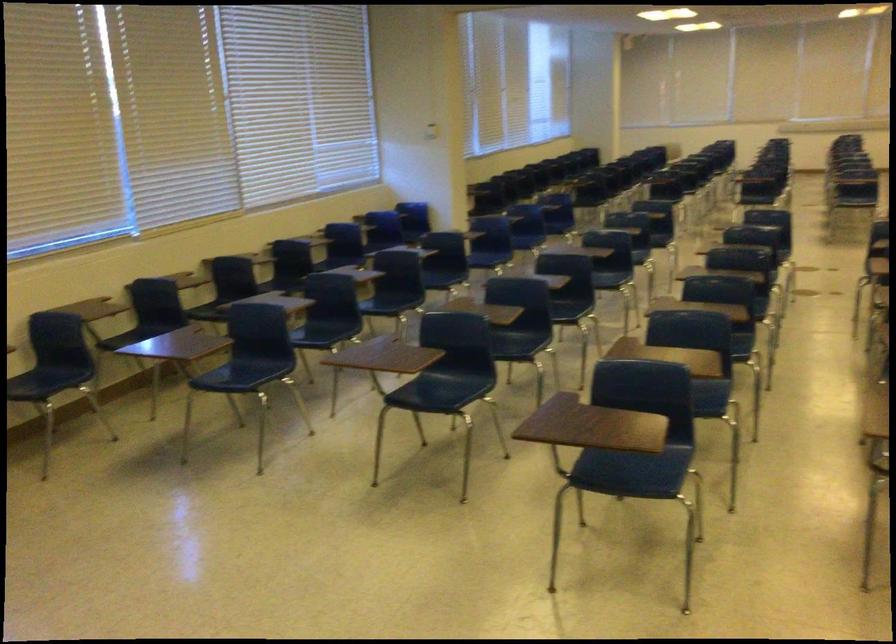
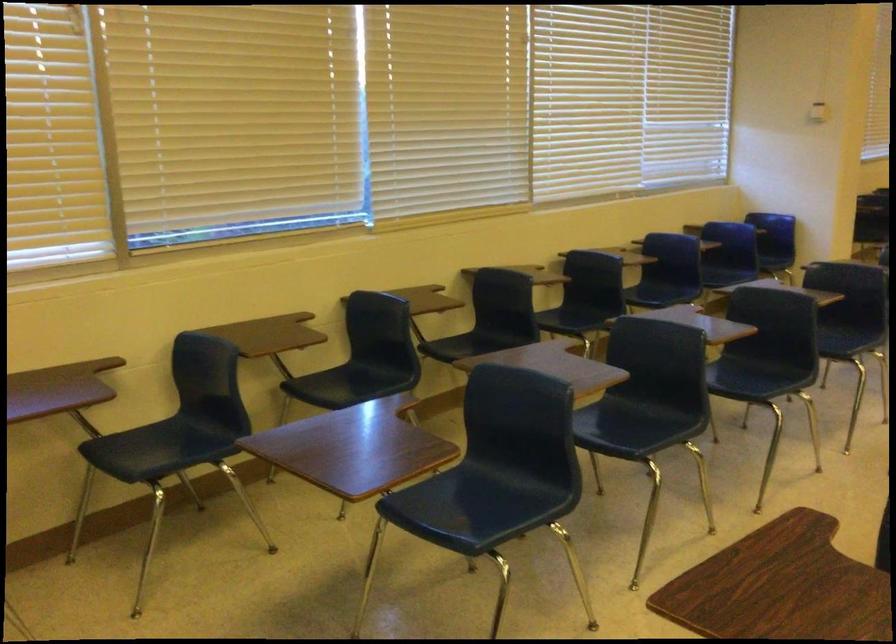
Question: What movement of the cameraman would produce the second image?

Choices:
 (A) Left
 (B) Right
 (C) Forward
 (D) Backward

Answer: (C)